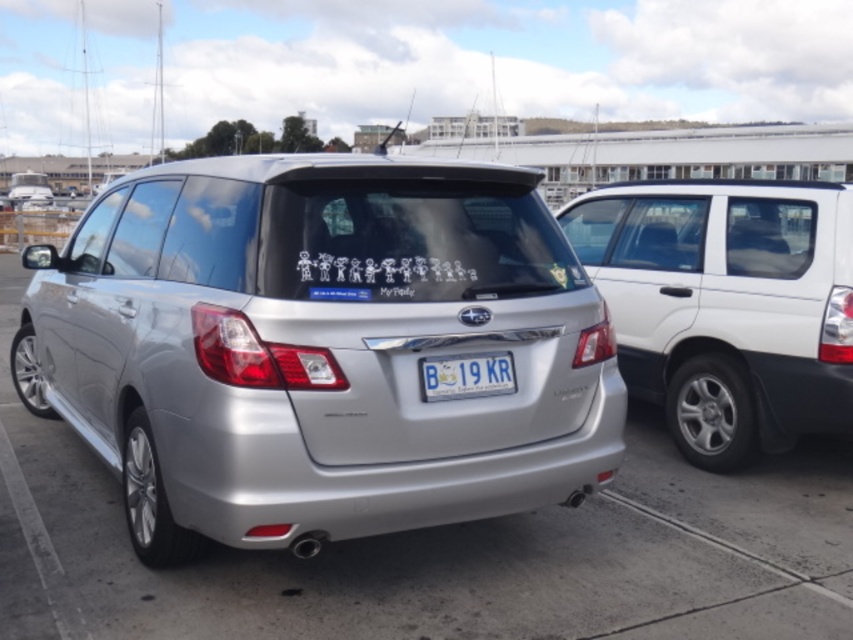
Question: Can you confirm if satin silver car at center is bigger than white matte minivan at right?

Choices:
 (A) yes
 (B) no

Answer: (A)

Question: Among these points, which one is farthest from the camera?

Choices:
 (A) (720, 285)
 (B) (462, 388)

Answer: (A)

Question: Which point appears closest to the camera in this image?

Choices:
 (A) (451, 385)
 (B) (291, 321)
 (C) (784, 220)

Answer: (B)

Question: Is satin silver car at center closer to the viewer compared to white plastic license plate at center?

Choices:
 (A) yes
 (B) no

Answer: (A)

Question: Which point appears closest to the camera in this image?

Choices:
 (A) (785, 348)
 (B) (373, 454)

Answer: (B)

Question: Does white matte minivan at right have a lesser width compared to white plastic license plate at center?

Choices:
 (A) yes
 (B) no

Answer: (B)